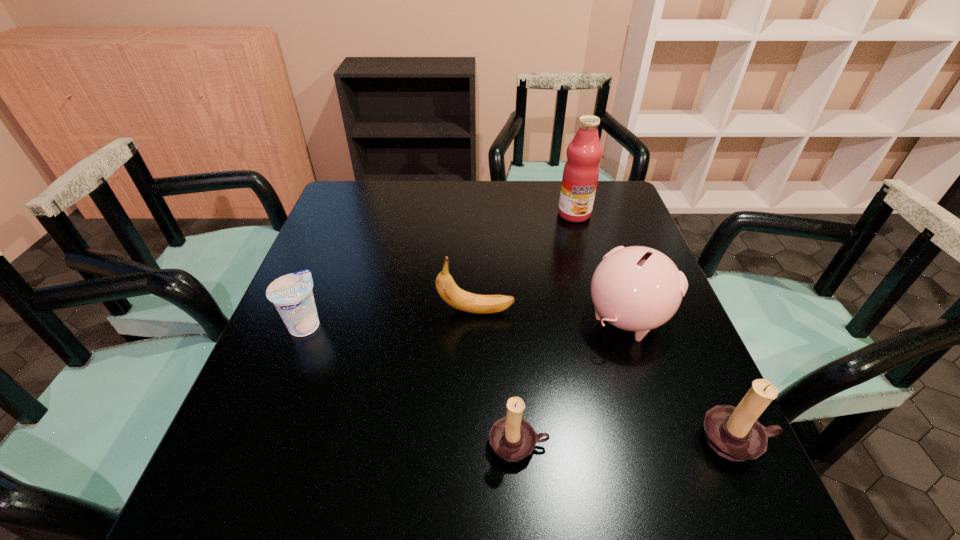
Find the location of `empty space between the shorter candle holder and the banana`. empty space between the shorter candle holder and the banana is located at coordinates (497, 377).

Where is `free space that is in between the farthest object and the leftmost object`? The width and height of the screenshot is (960, 540). free space that is in between the farthest object and the leftmost object is located at coordinates (440, 269).

What are the coordinates of `unoccupied position between the leftmost object and the fruit juice` in the screenshot? It's located at (440, 269).

Identify the location of object that is the fifth closest to the farthest object. (291, 294).

In order to click on the fourth closest object to the shorter candle holder in this screenshot , I will do `click(291, 294)`.

The width and height of the screenshot is (960, 540). I want to click on vacant space that satisfies the following two spatial constraints: 1. on the label of the tallest object; 2. at the start of the peel on the banana, so click(x=602, y=311).

Locate an element on the screen. The image size is (960, 540). vacant space that satisfies the following two spatial constraints: 1. at the start of the peel on the banana; 2. on the back side of the piggy bank is located at coordinates (476, 317).

The image size is (960, 540). In order to click on free point that satisfies the following two spatial constraints: 1. on the back side of the yogurt; 2. on the right side of the piggy bank in this screenshot , I will do `click(308, 317)`.